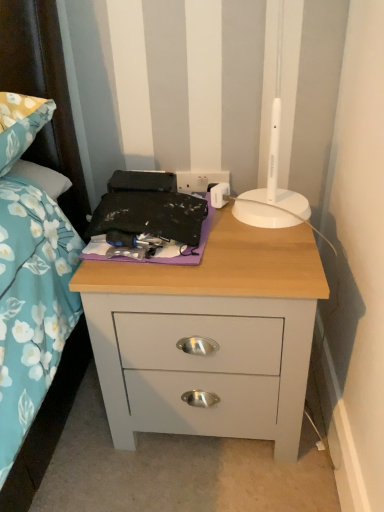
This screenshot has width=384, height=512. I want to click on matte gray nightstand at center, so click(210, 335).

Measure the distance between point [214,180] and camera.

Point [214,180] is 3.41 feet from camera.

You are a GUI agent. You are given a task and a screenshot of the screen. Output one action in this format:
    pyautogui.click(x=<x>, y=<y>)
    Task: Click on the white plastic electric outlet at upper center
    
    Given the screenshot: What is the action you would take?
    pyautogui.click(x=199, y=180)

Locate an element on the screen. This screenshot has width=384, height=512. matte gray nightstand at center is located at coordinates (210, 335).

Between white plastic electric outlet at upper center and matte gray nightstand at center, which one appears on the right side from the viewer's perspective?

matte gray nightstand at center.

Which of these two, white plastic electric outlet at upper center or matte gray nightstand at center, stands taller?

matte gray nightstand at center.

Between white plastic electric outlet at upper center and matte gray nightstand at center, which one is positioned in front?

Positioned in front is matte gray nightstand at center.

Is purple fabric at center bigger than matte gray nightstand at center?

Actually, purple fabric at center might be smaller than matte gray nightstand at center.

Considering the sizes of purple fabric at center and matte gray nightstand at center in the image, is purple fabric at center taller or shorter than matte gray nightstand at center?

In the image, purple fabric at center appears to be shorter than matte gray nightstand at center.

In the scene shown: From a real-world perspective, is purple fabric at center over matte gray nightstand at center?

Correct, in the physical world, purple fabric at center is higher than matte gray nightstand at center.

Locate an element on the screen. The width and height of the screenshot is (384, 512). sheet on the left of matte gray nightstand at center is located at coordinates (167, 229).

Does white plastic electric outlet at upper center appear on the left side of purple fabric at center?

Incorrect, white plastic electric outlet at upper center is not on the left side of purple fabric at center.

Would you consider white plastic electric outlet at upper center to be distant from purple fabric at center?

white plastic electric outlet at upper center is near purple fabric at center, not far away.

Does point (181, 189) lie behind point (194, 229)?

That is True.

Between white plastic electric outlet at upper center and purple fabric at center, which one has more height?

purple fabric at center.

Which of these two, matte gray nightstand at center or white plastic electric outlet at upper center, is bigger?

Bigger between the two is matte gray nightstand at center.

Is matte gray nightstand at center surrounding white plastic electric outlet at upper center?

Definitely not — white plastic electric outlet at upper center is not inside matte gray nightstand at center.

Is matte gray nightstand at center taller or shorter than white plastic electric outlet at upper center?

In the image, matte gray nightstand at center appears to be taller than white plastic electric outlet at upper center.

Does matte gray nightstand at center appear on the left side of white plastic electric outlet at upper center?

No.

In the scene shown: In the image, is matte gray nightstand at center positioned in front of or behind purple fabric at center?

Clearly, matte gray nightstand at center is in front of purple fabric at center.

Could you tell me if matte gray nightstand at center is turned towards purple fabric at center?

No.

Is matte gray nightstand at center inside or outside of purple fabric at center?

matte gray nightstand at center exists outside the volume of purple fabric at center.

Is matte gray nightstand at center touching purple fabric at center?

No.

Is point (172, 251) farther from viewer compared to point (211, 175)?

No, it is not.

Which is more to the right, purple fabric at center or white plastic electric outlet at upper center?

white plastic electric outlet at upper center is more to the right.

Looking at this image, is purple fabric at center oriented towards white plastic electric outlet at upper center?

No, purple fabric at center is not turned towards white plastic electric outlet at upper center.

Is purple fabric at center not close to white plastic electric outlet at upper center?

No, purple fabric at center is in close proximity to white plastic electric outlet at upper center.

Find the location of a particular element. The height and width of the screenshot is (512, 384). nightstand on the right of white plastic electric outlet at upper center is located at coordinates (210, 335).

Locate an element on the screen. This screenshot has width=384, height=512. nightstand lying below the purple fabric at center (from the image's perspective) is located at coordinates click(x=210, y=335).

Looking at this image, based on their spatial positions, is matte gray nightstand at center or purple fabric at center further from white plastic electric outlet at upper center?

Based on the image, matte gray nightstand at center appears to be further to white plastic electric outlet at upper center.

In the scene shown: Considering their positions, is matte gray nightstand at center positioned further to purple fabric at center than white plastic electric outlet at upper center?

The object further to purple fabric at center is white plastic electric outlet at upper center.

Looking at the image, which one is located further to matte gray nightstand at center, white plastic electric outlet at upper center or purple fabric at center?

white plastic electric outlet at upper center lies further to matte gray nightstand at center than the other object.

Based on their spatial positions, is purple fabric at center or white plastic electric outlet at upper center further from matte gray nightstand at center?

white plastic electric outlet at upper center is positioned further to the anchor matte gray nightstand at center.

From the image, which object appears to be farther from purple fabric at center, white plastic electric outlet at upper center or matte gray nightstand at center?

white plastic electric outlet at upper center is further to purple fabric at center.

Which object lies further to the anchor point white plastic electric outlet at upper center, purple fabric at center or matte gray nightstand at center?

Based on the image, matte gray nightstand at center appears to be further to white plastic electric outlet at upper center.

The width and height of the screenshot is (384, 512). What are the coordinates of `sheet between matte gray nightstand at center and white plastic electric outlet at upper center along the z-axis` in the screenshot? It's located at point(167,229).